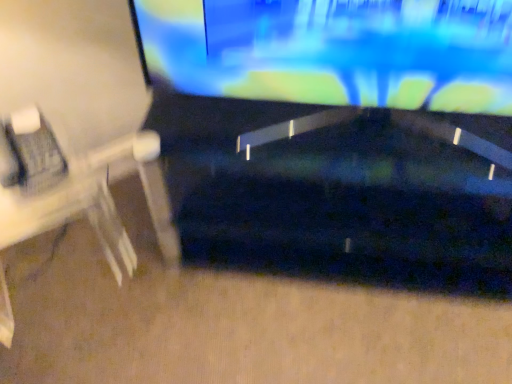
I want to click on vacant space in white plastic computer desk at left (from a real-world perspective), so click(x=60, y=256).